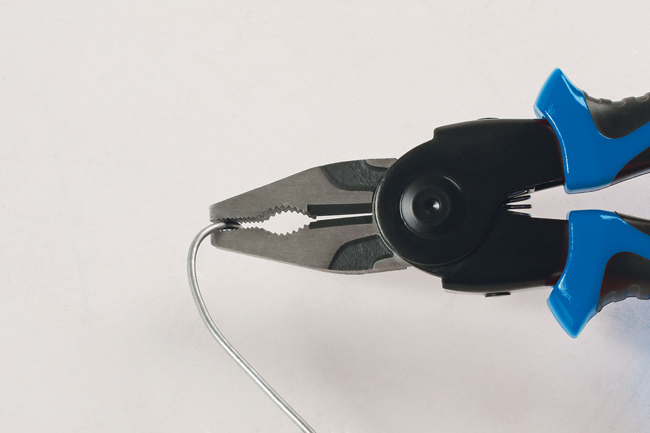
I want to click on screws, so click(491, 297), click(485, 120).